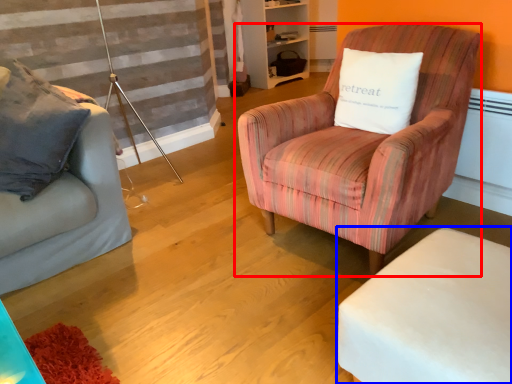
Question: Which object is closer to the camera taking this photo, chair (highlighted by a red box) or table (highlighted by a blue box)?

Choices:
 (A) chair
 (B) table

Answer: (B)